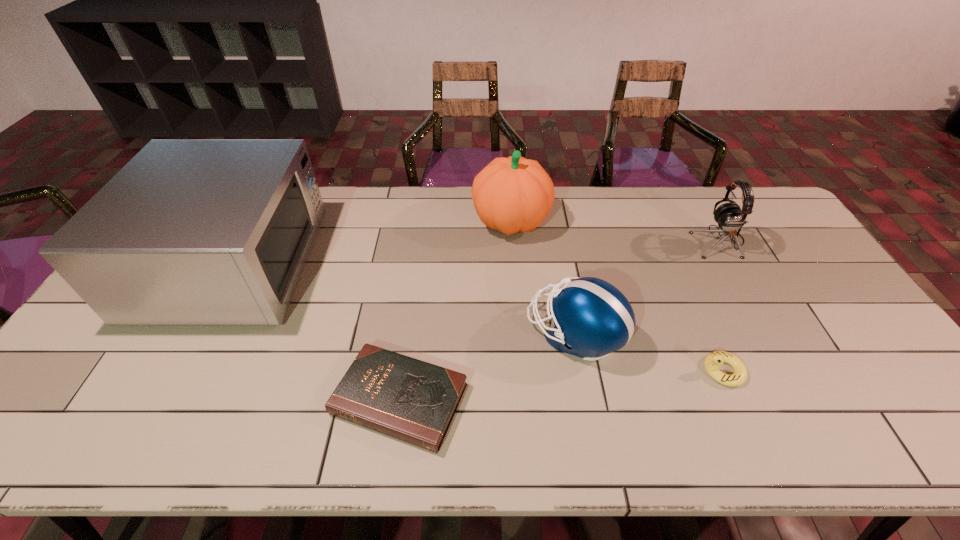
Identify the location of pumpkin at the far edge. The image size is (960, 540). (514, 194).

Identify the location of earphone present at the far edge. coord(729,216).

Locate an element on the screen. The width and height of the screenshot is (960, 540). object that is at the near edge is located at coordinates (414, 401).

Where is `object present at the left edge`? object present at the left edge is located at coordinates (189, 232).

This screenshot has width=960, height=540. I want to click on object that is at the far left corner, so click(x=189, y=232).

What are the coordinates of `vacant region at the far edge of the desktop` in the screenshot? It's located at (619, 190).

You are a GUI agent. You are given a task and a screenshot of the screen. Output one action in this format:
    pyautogui.click(x=<x>, y=<y>)
    Task: Click on the vacant space at the near edge of the desktop
    
    Given the screenshot: What is the action you would take?
    pyautogui.click(x=300, y=429)

What are the coordinates of `vacant space at the right edge of the desktop` in the screenshot? It's located at pyautogui.click(x=850, y=310).

Where is `free space at the far right corner of the desktop`? Image resolution: width=960 pixels, height=540 pixels. free space at the far right corner of the desktop is located at coordinates (753, 222).

Where is `empty space that is in between the duckling and the third tallest object`? The height and width of the screenshot is (540, 960). empty space that is in between the duckling and the third tallest object is located at coordinates (721, 306).